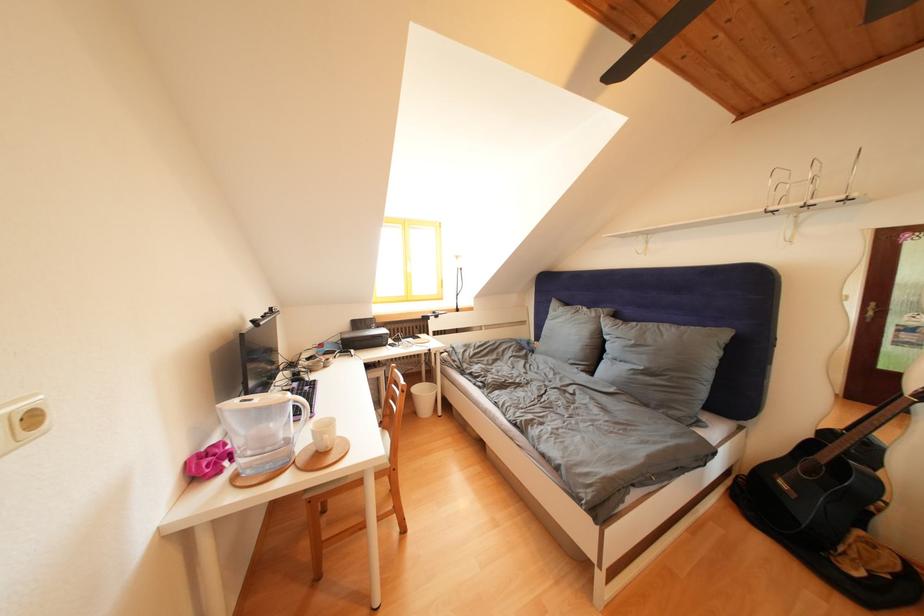
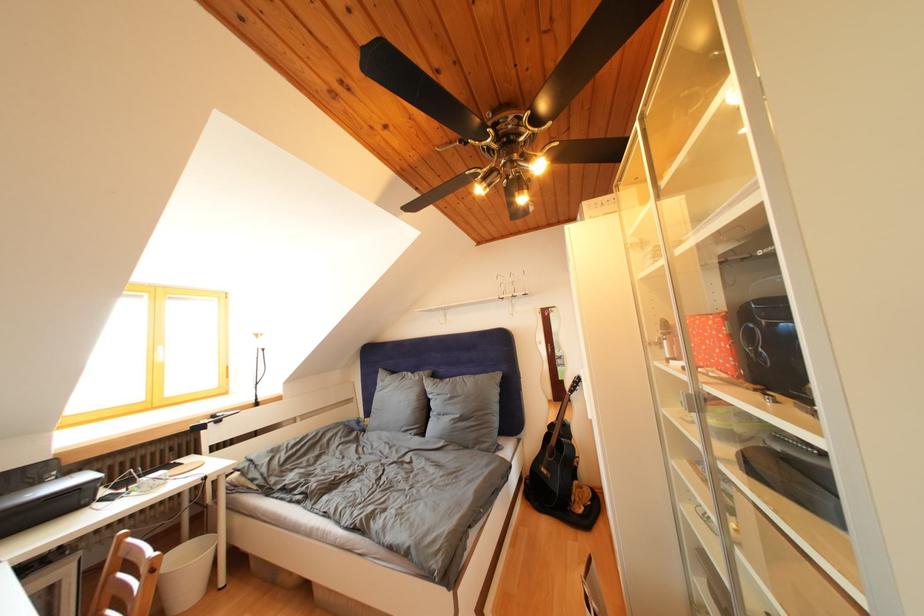
Locate, in the second image, the point that corresponds to point (602, 320) in the first image.

(426, 383)